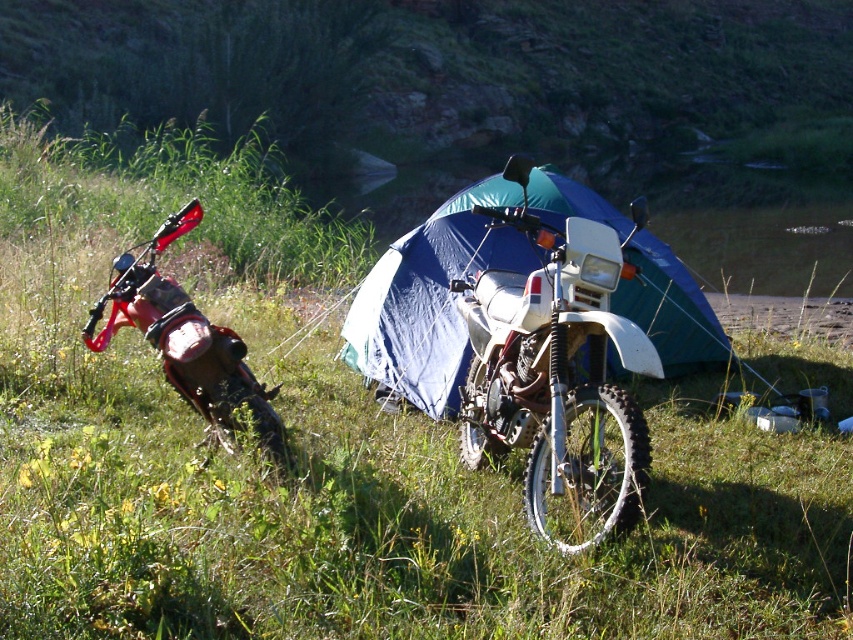
Question: Does blue fabric tent at center have a larger size compared to brushed metal motorcycle at left?

Choices:
 (A) yes
 (B) no

Answer: (A)

Question: Does blue fabric tent at center appear under brushed metal motorcycle at left?

Choices:
 (A) no
 (B) yes

Answer: (A)

Question: Is white matte motorcycle at center positioned in front of brushed metal motorcycle at left?

Choices:
 (A) no
 (B) yes

Answer: (B)

Question: Which of these objects is positioned closest to the brushed metal motorcycle at left?

Choices:
 (A) white matte motorcycle at center
 (B) blue fabric tent at center

Answer: (A)

Question: Estimate the real-world distances between objects in this image. Which object is closer to the blue fabric tent at center?

Choices:
 (A) white matte motorcycle at center
 (B) brushed metal motorcycle at left

Answer: (A)

Question: Which point is closer to the camera?

Choices:
 (A) (131, 272)
 (B) (351, 353)
 (C) (486, 413)

Answer: (A)